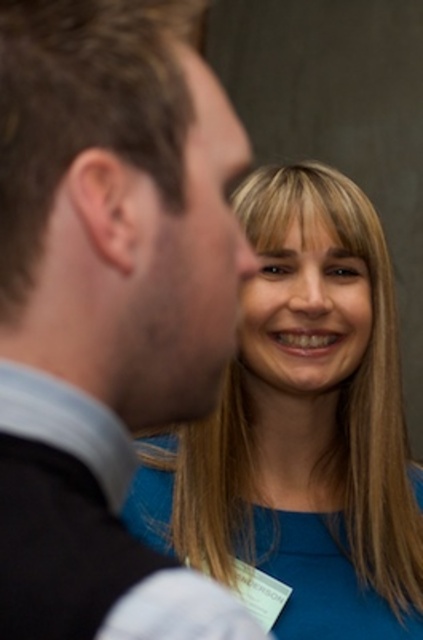
Question: Which point is farther to the camera?

Choices:
 (A) brown matte hair at upper left
 (B) dark brown hair at left
 (C) blue fabric shirt at center

Answer: (C)

Question: Does dark brown hair at left have a greater width compared to brown matte hair at upper left?

Choices:
 (A) yes
 (B) no

Answer: (A)

Question: Is dark brown hair at left thinner than brown matte hair at upper left?

Choices:
 (A) no
 (B) yes

Answer: (A)

Question: Among these points, which one is nearest to the camera?

Choices:
 (A) (412, 556)
 (B) (3, 616)
 (C) (30, 26)

Answer: (B)

Question: Is blue fabric shirt at center bigger than brown matte hair at upper left?

Choices:
 (A) yes
 (B) no

Answer: (A)

Question: Which point is farther to the camera?

Choices:
 (A) blue fabric shirt at center
 (B) brown matte hair at upper left
 (C) dark brown hair at left

Answer: (A)